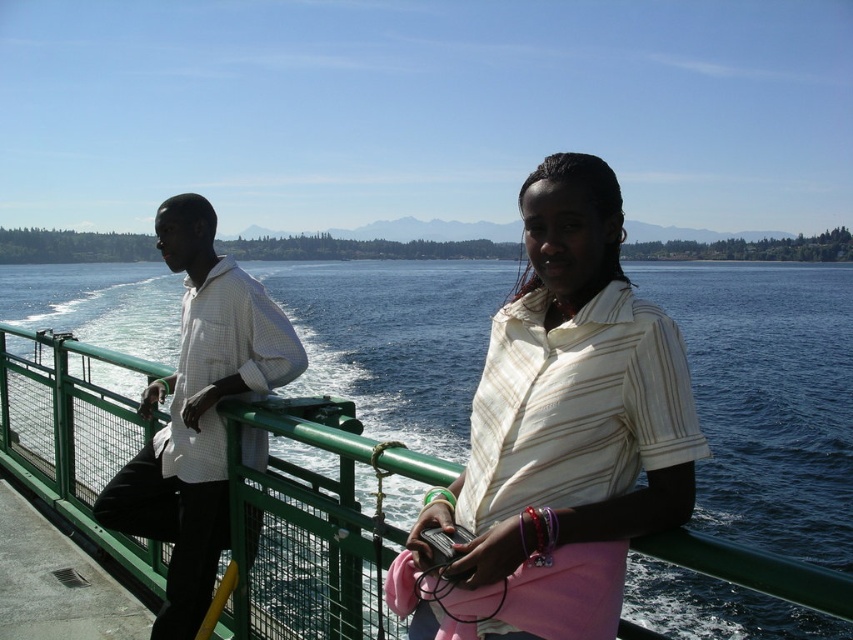
In order to click on white striped shirt at center in this screenshot , I will do `click(560, 436)`.

Which is above, white striped shirt at center or white checkered shirt at left?

white striped shirt at center

Is point (643, 346) positioned in front of point (219, 529)?

Yes, point (643, 346) is closer to viewer.

At what (x,y) coordinates should I click in order to perform the action: click on white striped shirt at center. Please return your answer as a coordinate pair (x, y). Looking at the image, I should click on (560, 436).

Can you confirm if blue water at center is taller than white checkered shirt at left?

Yes.

Is blue water at center bigger than white checkered shirt at left?

Indeed, blue water at center has a larger size compared to white checkered shirt at left.

You are a GUI agent. You are given a task and a screenshot of the screen. Output one action in this format:
    pyautogui.click(x=<x>, y=<y>)
    Task: Click on the blue water at center
    This screenshot has width=853, height=640.
    Given the screenshot: What is the action you would take?
    pyautogui.click(x=769, y=397)

This screenshot has width=853, height=640. In order to click on blue water at center in this screenshot , I will do `click(769, 397)`.

Where is `blue water at center`? The image size is (853, 640). blue water at center is located at coordinates (769, 397).

Does blue water at center appear on the right side of white striped shirt at center?

Correct, you'll find blue water at center to the right of white striped shirt at center.

Identify the location of blue water at center. (769, 397).

You are a GUI agent. You are given a task and a screenshot of the screen. Output one action in this format:
    pyautogui.click(x=<x>, y=<y>)
    Task: Click on the blue water at center
    This screenshot has width=853, height=640.
    Given the screenshot: What is the action you would take?
    pyautogui.click(x=769, y=397)